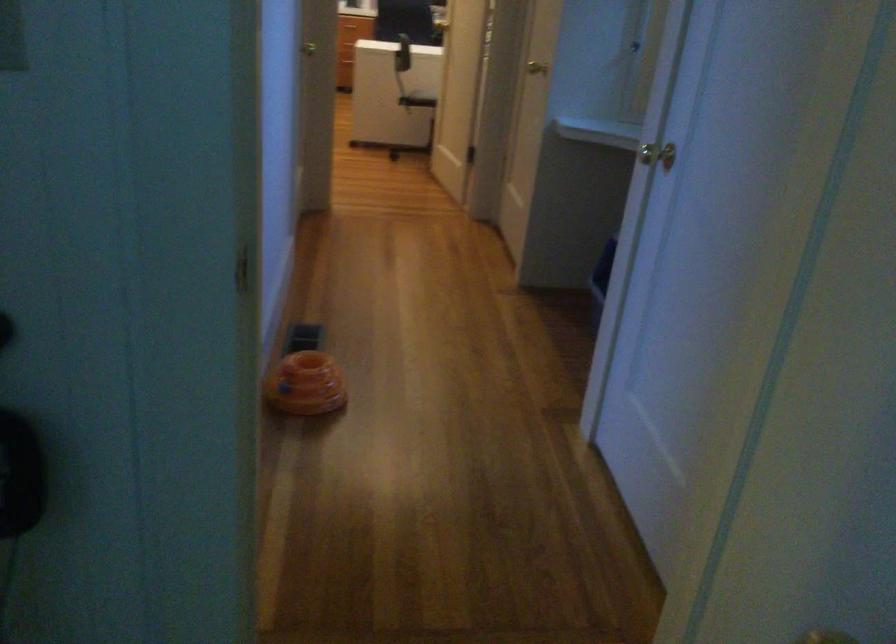
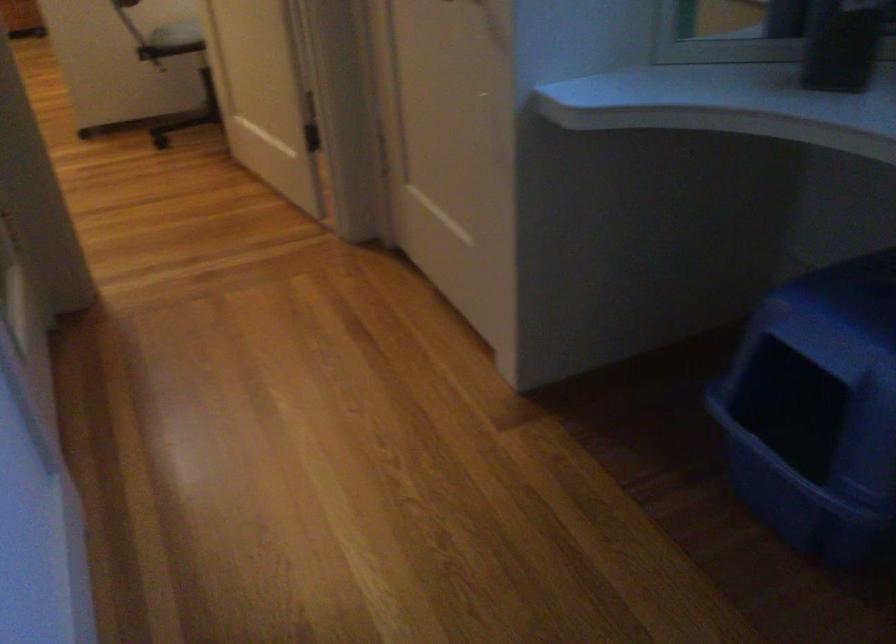
Question: The images are taken continuously from a first-person perspective. In which direction are you moving?

Choices:
 (A) Left
 (B) Right
 (C) Forward
 (D) Backward

Answer: (C)